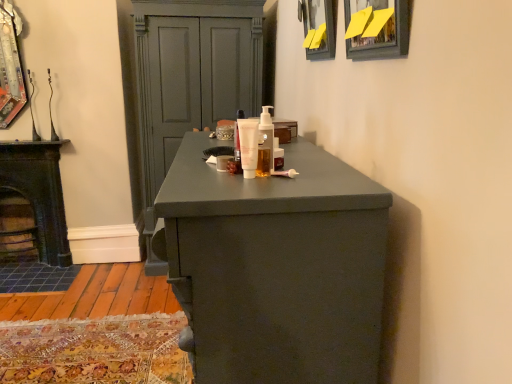
I want to click on vacant region to the left of white matte tube at center, the first mouthwash in the front-to-back sequence, so click(196, 173).